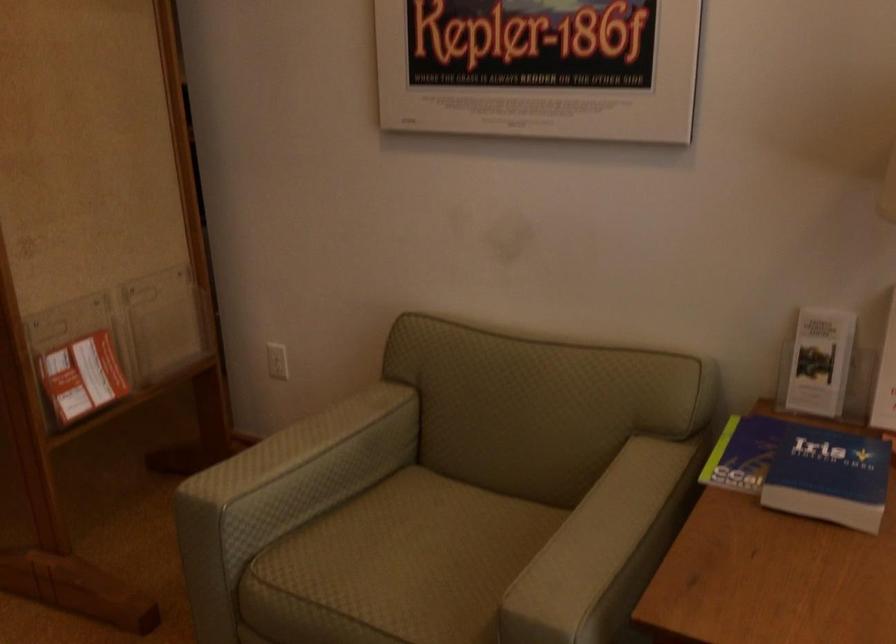
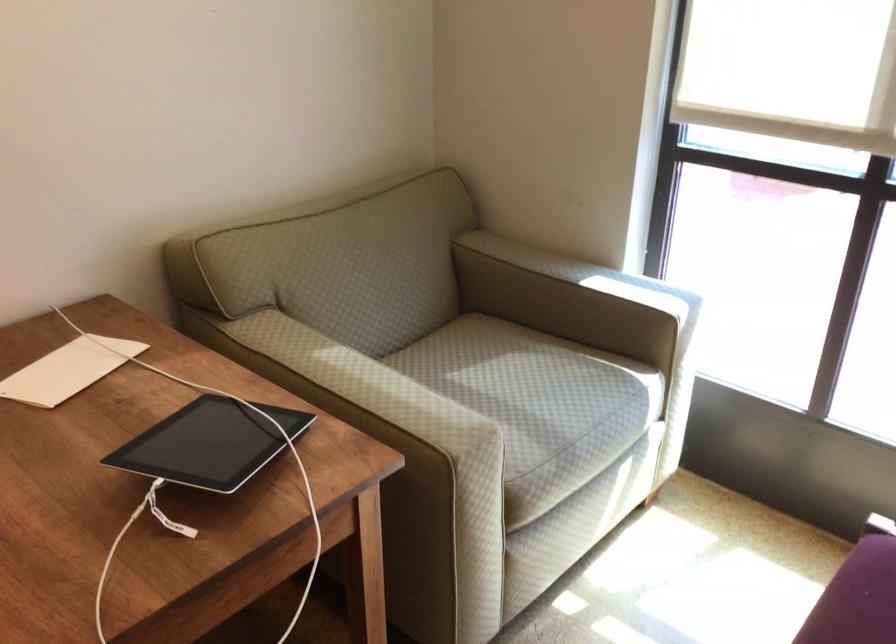
Looking at this image, based on the continuous images, in which direction is the camera rotating?

The camera's rotation is toward right-down.